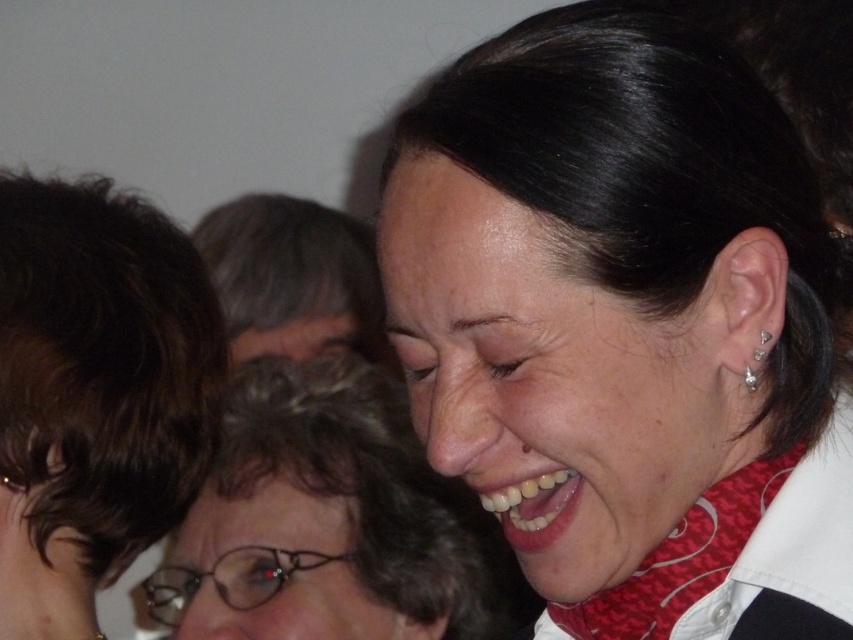
Is matte black hair at upper center taller than matte black hair at center?

Incorrect, matte black hair at upper center's height is not larger of matte black hair at center's.

Consider the image. Is matte black hair at upper center further to the viewer compared to matte black hair at center?

That is False.

Is point (463, 586) positioned after point (259, 340)?

No.

The height and width of the screenshot is (640, 853). What are the coordinates of `matte black hair at upper center` in the screenshot? It's located at (325, 518).

Which is more to the left, matte black hair at upper center or silver metallic stud at ear?

Positioned to the left is matte black hair at upper center.

Is point (201, 602) positioned after point (759, 358)?

That is True.

Identify the location of matte black hair at upper center. The width and height of the screenshot is (853, 640). (325, 518).

Which is above, matte black hair at upper right or matte black hair at center?

Positioned higher is matte black hair at center.

Does point (572, 544) come closer to viewer compared to point (263, 208)?

Yes.

The width and height of the screenshot is (853, 640). In order to click on matte black hair at upper right in this screenshot , I will do `click(630, 326)`.